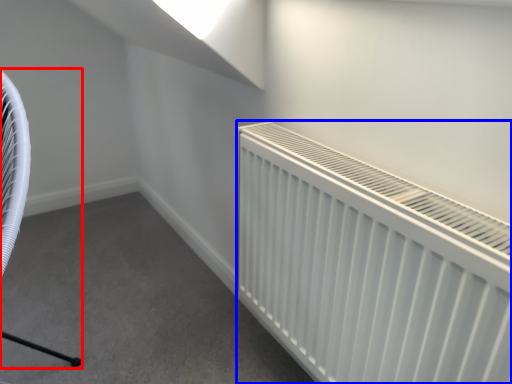
Question: Which point is closer to the camera, swivel chair (highlighted by a red box) or radiator (highlighted by a blue box)?

Choices:
 (A) swivel chair
 (B) radiator

Answer: (A)